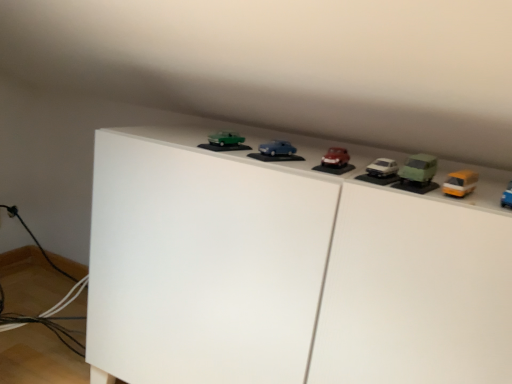
Question: Is white matte cabinet at upper center positioned beyond the bounds of green matte car at right, marked as the 4th toy in a left-to-right arrangement?

Choices:
 (A) no
 (B) yes

Answer: (B)

Question: Does white matte cabinet at upper center lie behind green matte car at right, placed as the second toy when sorted from right to left?

Choices:
 (A) yes
 (B) no

Answer: (B)

Question: Considering the relative sizes of white matte cabinet at upper center and green matte car at right, placed as the second toy when sorted from right to left, in the image provided, is white matte cabinet at upper center thinner than green matte car at right, placed as the second toy when sorted from right to left,?

Choices:
 (A) yes
 (B) no

Answer: (B)

Question: From a real-world perspective, is white matte cabinet at upper center positioned over green matte car at right, placed as the second toy when sorted from right to left, based on gravity?

Choices:
 (A) no
 (B) yes

Answer: (A)

Question: From the image's perspective, is white matte cabinet at upper center beneath green matte car at right, placed as the second toy when sorted from right to left?

Choices:
 (A) no
 (B) yes

Answer: (B)

Question: Does white matte cabinet at upper center touch green matte car at right, marked as the 4th toy in a left-to-right arrangement?

Choices:
 (A) yes
 (B) no

Answer: (B)

Question: From the image's perspective, is yellow matte van at upper right, the fifth toy viewed from the left, under matte blue car at center, which is the 4th toy in right-to-left order?

Choices:
 (A) yes
 (B) no

Answer: (A)

Question: Does yellow matte van at upper right, the fifth toy viewed from the left, come behind matte blue car at center, the 2th toy from the left?

Choices:
 (A) yes
 (B) no

Answer: (B)

Question: From a real-world perspective, is yellow matte van at upper right, the first toy from the right, physically above matte blue car at center, the 2th toy from the left?

Choices:
 (A) no
 (B) yes

Answer: (A)

Question: Does yellow matte van at upper right, the first toy from the right, have a smaller size compared to matte blue car at center, the 2th toy from the left?

Choices:
 (A) no
 (B) yes

Answer: (B)

Question: From the image's perspective, is yellow matte van at upper right, the first toy from the right, located above matte blue car at center, the 2th toy from the left?

Choices:
 (A) no
 (B) yes

Answer: (A)

Question: Is yellow matte van at upper right, the fifth toy viewed from the left, placed right next to matte blue car at center, the 2th toy from the left?

Choices:
 (A) no
 (B) yes

Answer: (A)

Question: Is white matte cabinet at upper center directly adjacent to matte blue car at center, which is the 4th toy in right-to-left order?

Choices:
 (A) no
 (B) yes

Answer: (A)